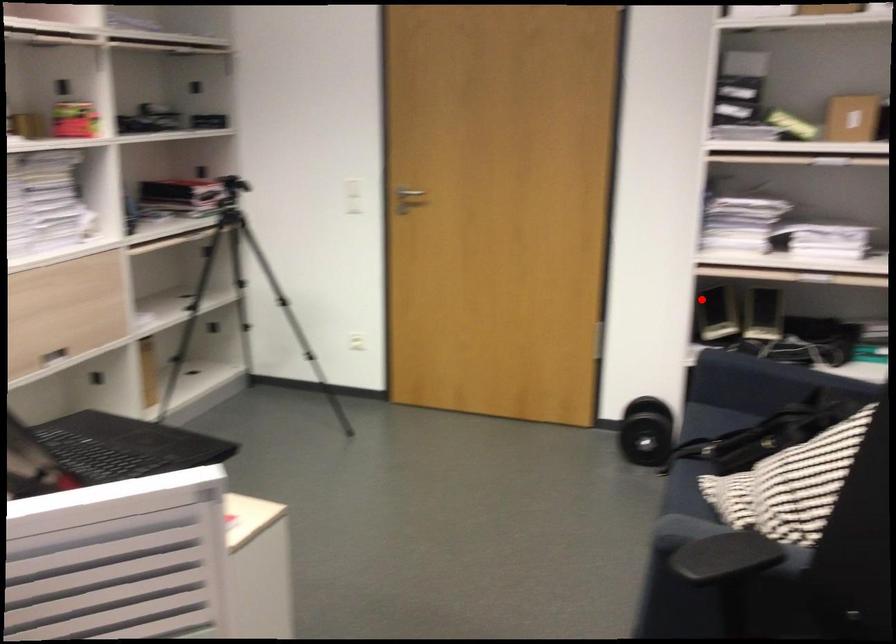
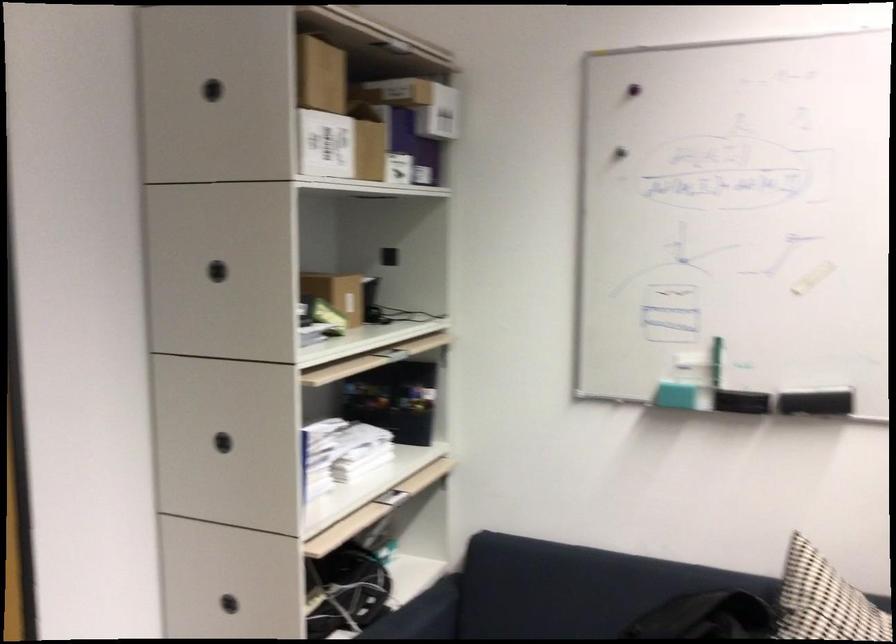
Find the pixel in the second image that matches the highlighted location in the first image.

(228, 603)